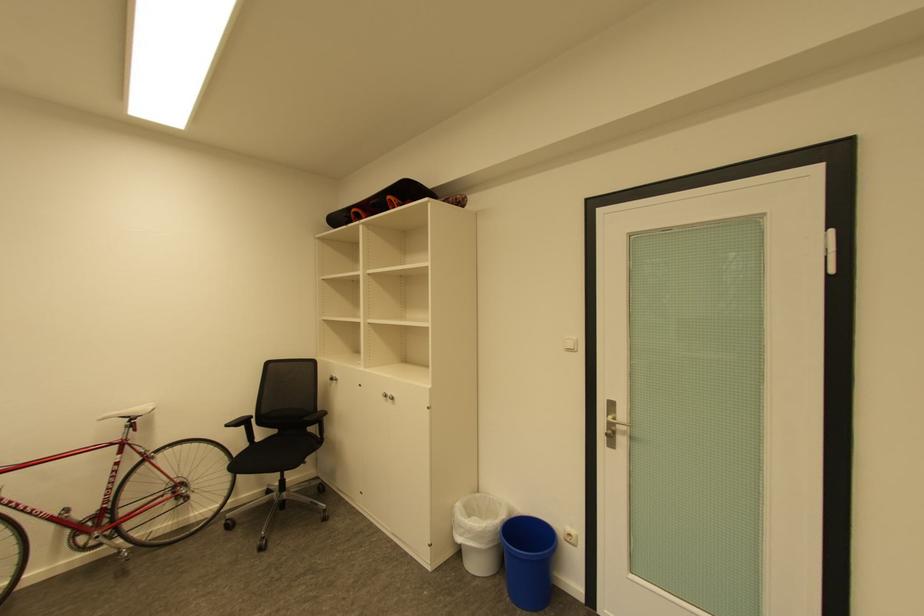
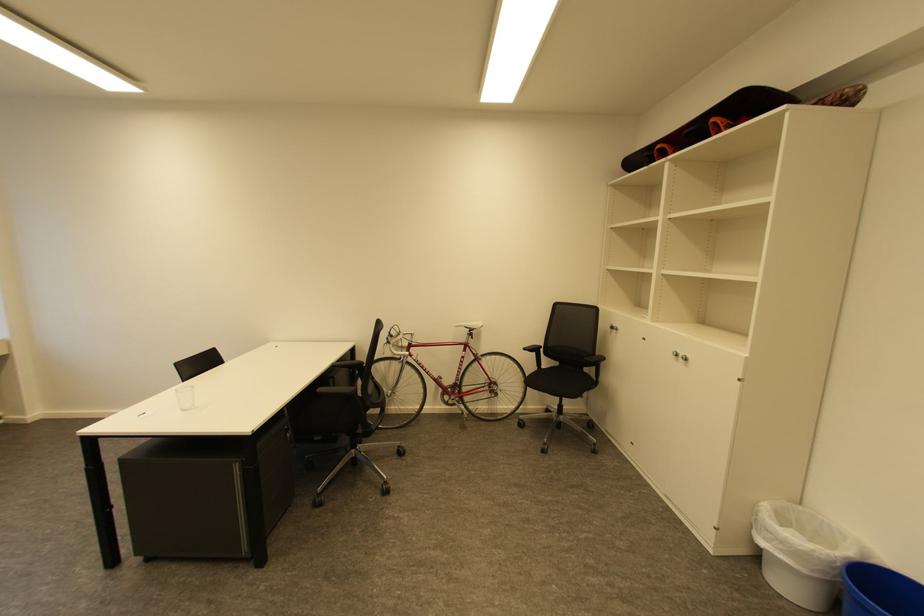
Locate, in the second image, the point that corresponds to point 396,399 in the first image.

(689, 359)